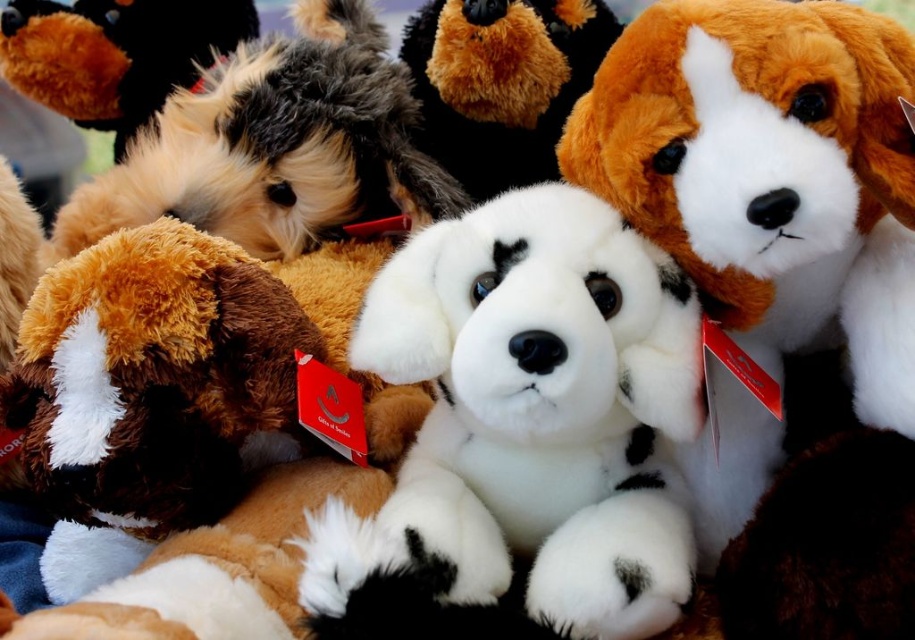
You are looking at an arrangement of dog toys and need to place a new toy between the white plush dog with black spots and the brown plush dog at left. Based on their positions, where should you place the new toy?

The brown plush dog at left is located at point 2D coordinates (192, 422). The white plush dog with black spots is in the foreground. To place the new toy between them, position it along the line connecting their coordinates, ensuring it is equidistant from both.

You are taking a photo of the two points labeled as point (100, 227) and point (531, 44). Which point will appear closer to the camera in the photo?

Point (100, 227) is further to the camera than point (531, 44), so point (100, 227) will appear closer to the camera in the photo.